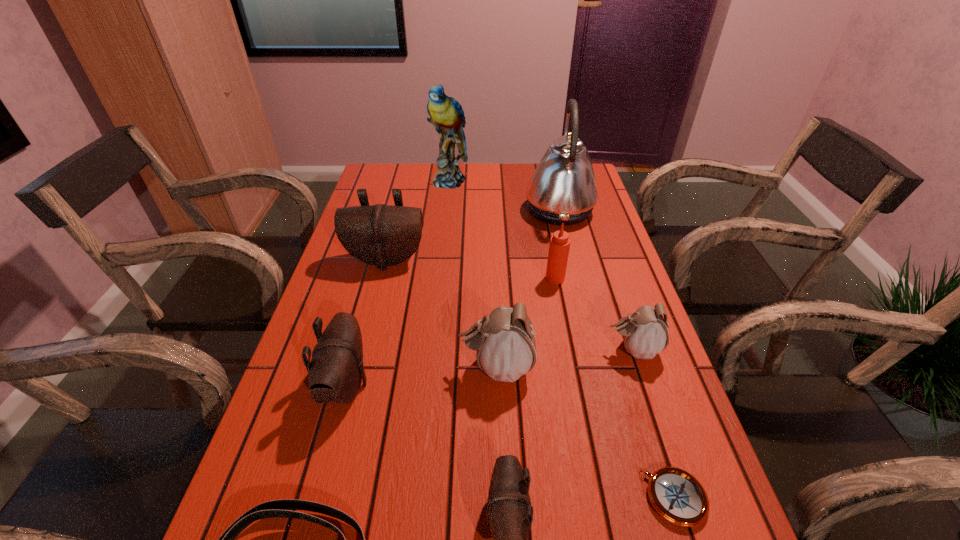
You are a GUI agent. You are given a task and a screenshot of the screen. Output one action in this format:
    pyautogui.click(x=<x>, y=<y>)
    Task: Click on the free point located 0.210m on the front-facing side of the rightmost pouch
    The width and height of the screenshot is (960, 540).
    Given the screenshot: What is the action you would take?
    pyautogui.click(x=514, y=350)

In order to click on vacant space located 0.320m on the back of the shortest object in this screenshot , I will do `click(623, 335)`.

Locate an element on the screen. The width and height of the screenshot is (960, 540). parrot present at the far edge is located at coordinates (446, 114).

Where is `kettle that is at the far edge`? Image resolution: width=960 pixels, height=540 pixels. kettle that is at the far edge is located at coordinates (563, 189).

Where is `kettle that is positioned at the right edge`? Image resolution: width=960 pixels, height=540 pixels. kettle that is positioned at the right edge is located at coordinates (563, 189).

You are a GUI agent. You are given a task and a screenshot of the screen. Output one action in this format:
    pyautogui.click(x=<x>, y=<y>)
    Task: Click on the pouch that is at the right edge
    The image size is (960, 540).
    Given the screenshot: What is the action you would take?
    pyautogui.click(x=645, y=334)

What are the coordinates of `compass that is at the right edge` in the screenshot? It's located at (677, 496).

Locate an element on the screen. object that is positioned at the far right corner is located at coordinates (563, 189).

Where is `vacant area at the far edge of the desktop`? vacant area at the far edge of the desktop is located at coordinates (512, 164).

The height and width of the screenshot is (540, 960). In order to click on blank area at the left edge in this screenshot , I will do `click(280, 518)`.